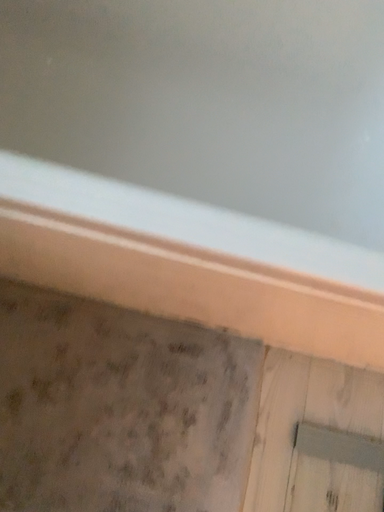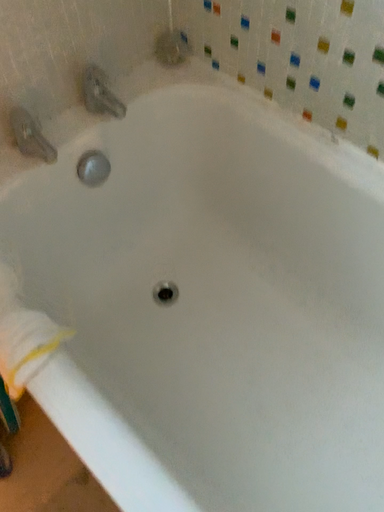
Question: Which way did the camera rotate in the video?

Choices:
 (A) rotated right
 (B) rotated left

Answer: (B)